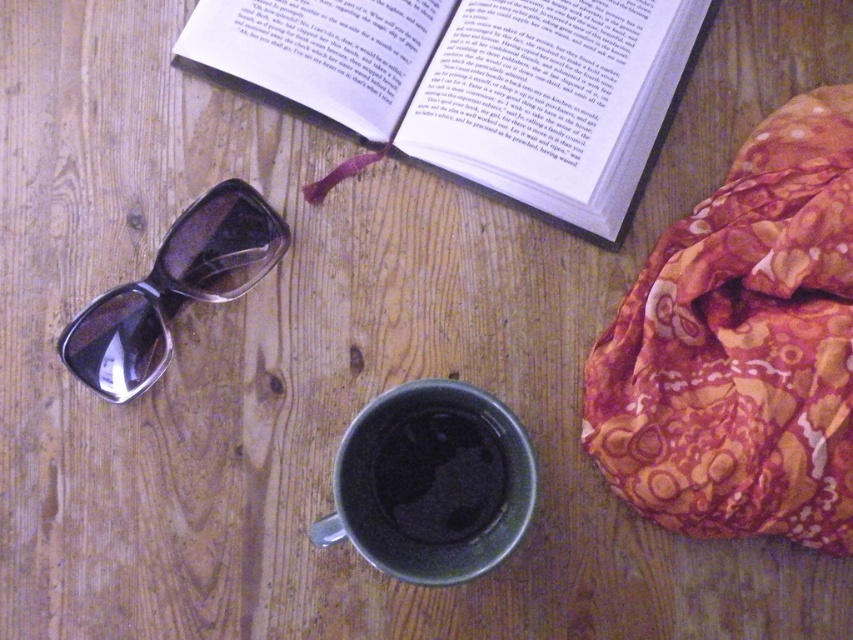
You are organizing items on the wooden surface and need to place a new item between the floral silk scarf at upper right and the black matte mug at center. Based on their sizes, which item should be placed closer to the center of the surface?

The black matte mug at center is smaller than the floral silk scarf at upper right, so placing it closer to the center would allow more space for the larger scarf on the right side.

You are standing at the origin of the coordinate system. Which of the two points, point (x=332, y=109) or point (x=461, y=428), is closer to you?

Point (x=461, y=428) is closer to you because it is in front of point (x=332, y=109).

In the scene shown: You are organizing items on a wooden table and need to place the floral silk scarf at upper right and the black matte mug at center. Based on their positions, which item is closer to the edge of the table?

The floral silk scarf at upper right is closer to the edge of the table because it is located above the black matte mug at center, meaning it is positioned nearer to the upper edge.